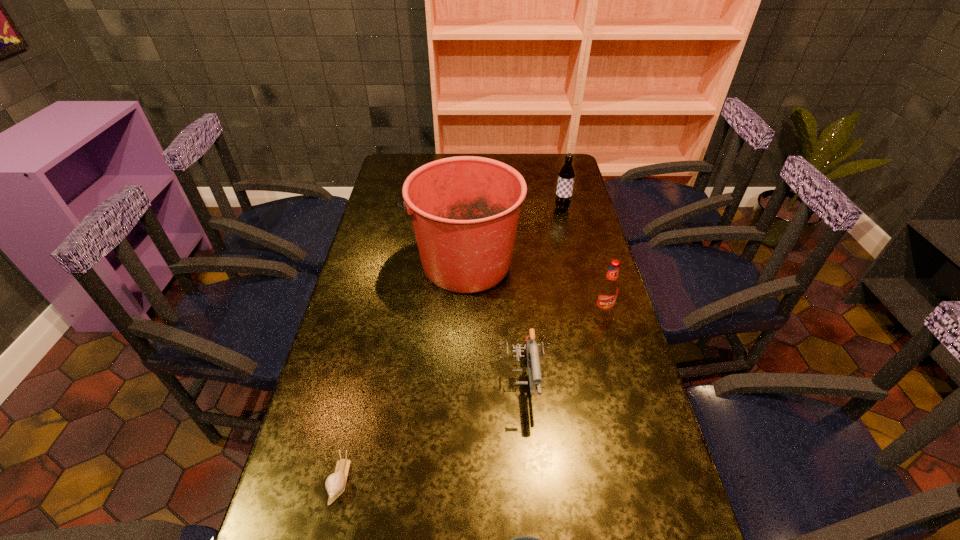
Identify the location of the third closest object to the farthest object. (530, 349).

Locate an element on the screen. This screenshot has width=960, height=540. object that is the second closest to the tallest object is located at coordinates (566, 175).